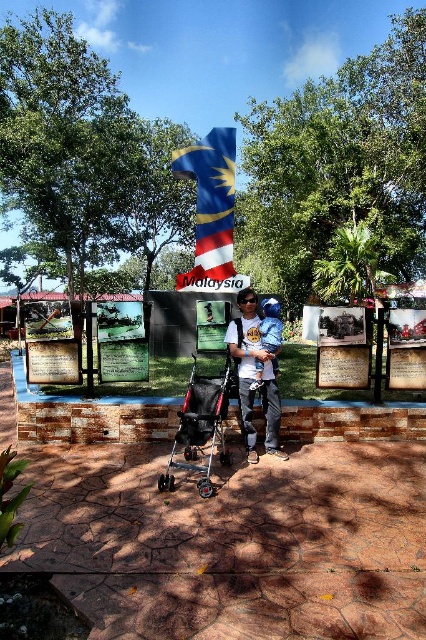
Can you confirm if malaysian flag at center is smaller than black plastic baby carriage at center?

Incorrect, malaysian flag at center is not smaller in size than black plastic baby carriage at center.

Is malaysian flag at center thinner than black plastic baby carriage at center?

No.

Locate an element on the screen. This screenshot has width=426, height=640. malaysian flag at center is located at coordinates (210, 204).

Between point (172, 160) and point (252, 314), which one is positioned in front?

Point (252, 314) is in front.

Locate an element on the screen. This screenshot has width=426, height=640. malaysian flag at center is located at coordinates (210, 204).

Between malaysian flag at center and blue denim pants at center, which one appears on the left side from the viewer's perspective?

From the viewer's perspective, malaysian flag at center appears more on the left side.

Can you confirm if malaysian flag at center is bigger than blue denim pants at center?

Correct, malaysian flag at center is larger in size than blue denim pants at center.

Does point (203, 196) come in front of point (279, 340)?

No, it is behind (279, 340).

Identify the location of malaysian flag at center. (210, 204).